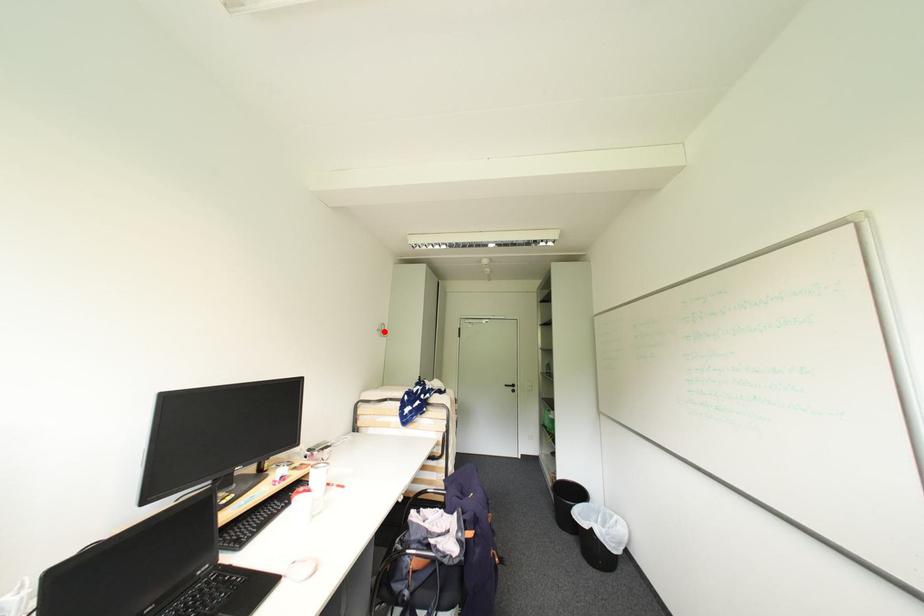
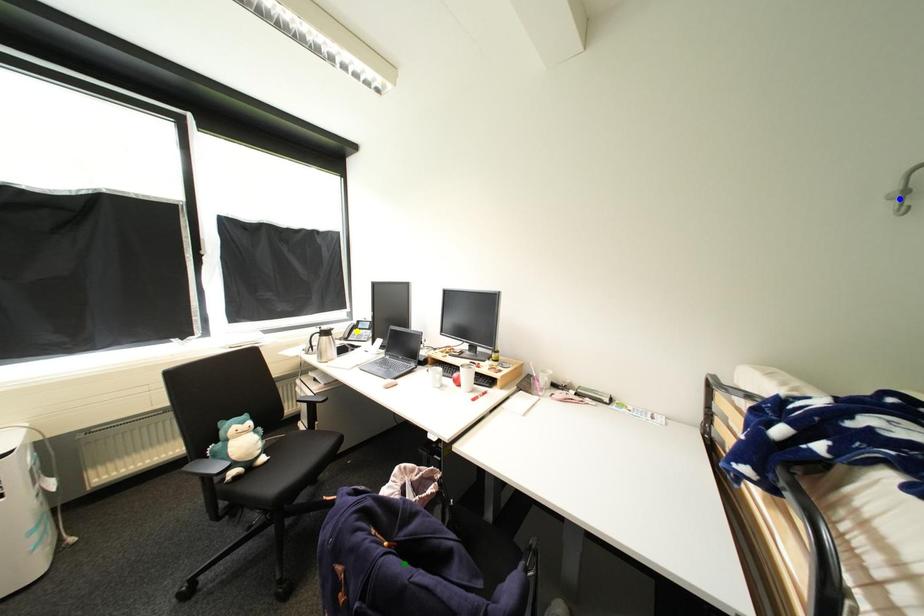
Question: I am providing you with two images of the same scene from different viewpoints. A red point is marked on the first image. You are given multiple points on the second image. Can you choose the point in image 2 that corresponds to the point in image 1?

Choices:
 (A) blue point
 (B) yellow point
 (C) green point

Answer: (A)